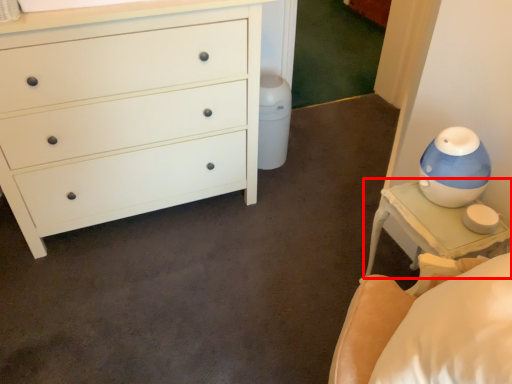
Question: From the image's perspective, what is the correct spatial relationship of nightstand (annotated by the red box) in relation to chest of drawers?

Choices:
 (A) above
 (B) below

Answer: (B)